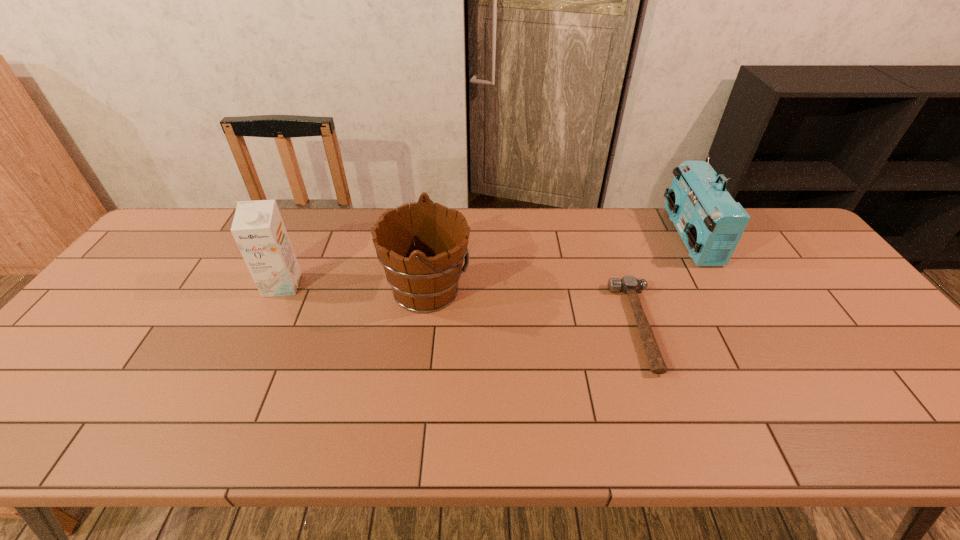
Find the location of `the rightmost object`. the rightmost object is located at coordinates (710, 222).

Find the location of a particular element. The width and height of the screenshot is (960, 540). carton is located at coordinates (258, 229).

Locate an element on the screen. the third object from right to left is located at coordinates (422, 248).

You are a GUI agent. You are given a task and a screenshot of the screen. Output one action in this format:
    pyautogui.click(x=<x>, y=<y>)
    Task: Click on the hammer
    
    Given the screenshot: What is the action you would take?
    pyautogui.click(x=628, y=284)

Where is `the second object from right to left`? This screenshot has height=540, width=960. the second object from right to left is located at coordinates [628, 284].

The image size is (960, 540). Find the location of `vacant space located on the front-facing side of the rightmost object`. vacant space located on the front-facing side of the rightmost object is located at coordinates (638, 237).

I want to click on vacant space situated on the front-facing side of the rightmost object, so click(651, 237).

Where is `vacant region located on the front-facing side of the rightmost object`? The image size is (960, 540). vacant region located on the front-facing side of the rightmost object is located at coordinates (641, 237).

The width and height of the screenshot is (960, 540). Identify the location of vacant region located on the front of the carton. (262, 328).

Where is `vacant space located with the handle on the third object from right to left`? vacant space located with the handle on the third object from right to left is located at coordinates (496, 291).